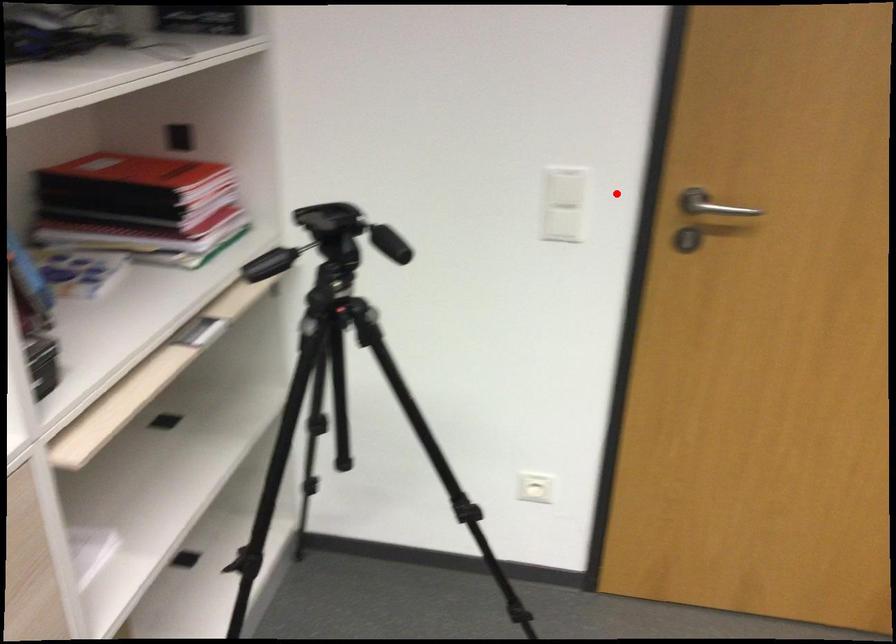
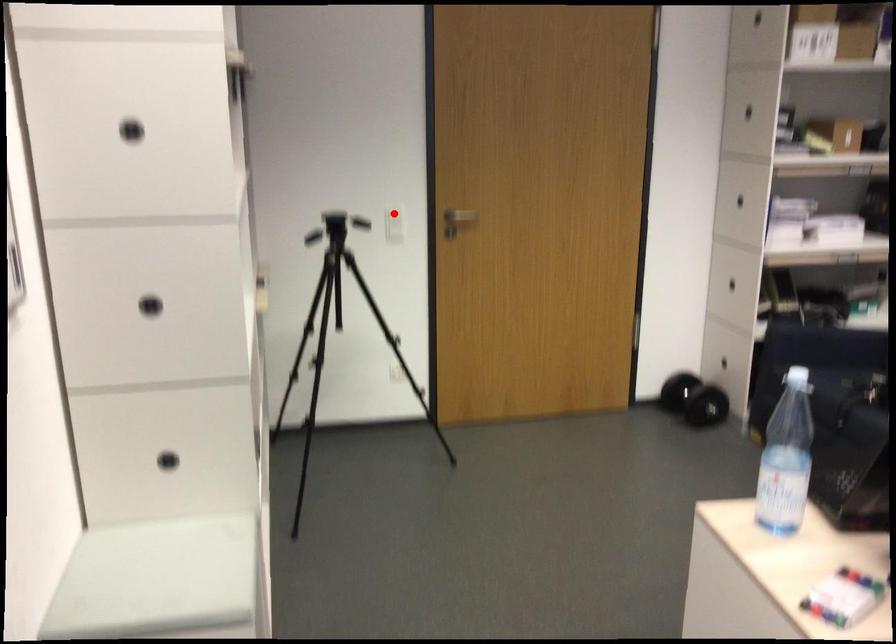
I am providing you with two images of the same scene from different viewpoints. A red point is marked on the first image and another point is marked on the second image. Is the marked point in image1 the same physical position as the marked point in image2?

Yes